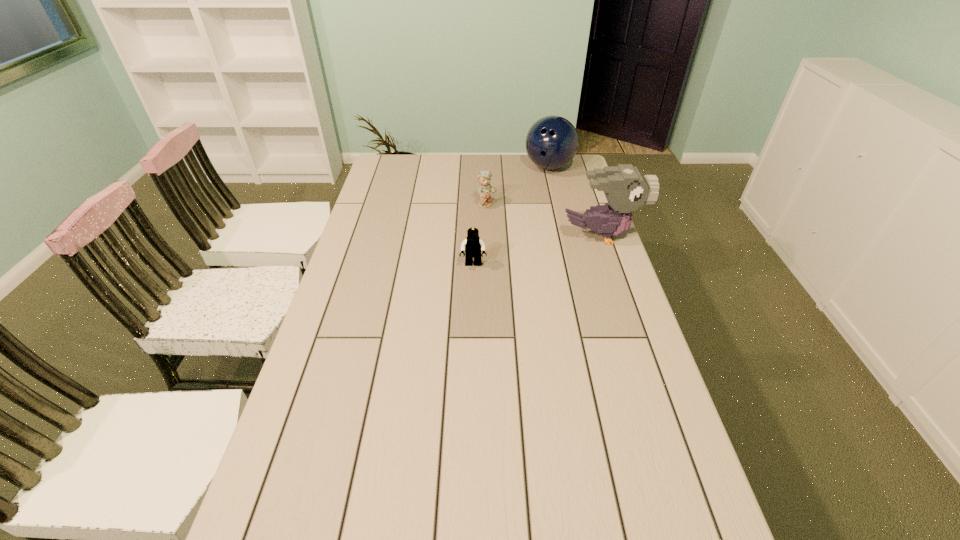
This screenshot has height=540, width=960. What are the coordinates of `Lego` in the screenshot? It's located at (472, 245).

At what (x,y) coordinates should I click in order to perform the action: click on bird. Please return your answer as a coordinate pair (x, y). The image size is (960, 540). Looking at the image, I should click on (626, 189).

This screenshot has width=960, height=540. I want to click on teddy bear, so click(485, 190).

The image size is (960, 540). In order to click on bowling ball in this screenshot , I will do `click(551, 143)`.

The height and width of the screenshot is (540, 960). I want to click on vacant space located 0.350m on the front-facing side of the nearest object, so click(471, 357).

Locate an element on the screen. This screenshot has height=540, width=960. vacant space located on the front-facing side of the second farthest object is located at coordinates (573, 257).

I want to click on free region located 0.250m on the front-facing side of the second farthest object, so click(542, 238).

Where is `vacant space located on the front-facing side of the second farthest object`? vacant space located on the front-facing side of the second farthest object is located at coordinates (504, 215).

At what (x,y) coordinates should I click in order to perform the action: click on vacant area located on the surface of the bowling ball near the finger holes. Please return your answer as a coordinate pair (x, y). This screenshot has height=540, width=960. Looking at the image, I should click on pos(547,219).

Image resolution: width=960 pixels, height=540 pixels. I want to click on vacant region located 0.070m on the surface of the bowling ball near the finger holes, so click(x=548, y=188).